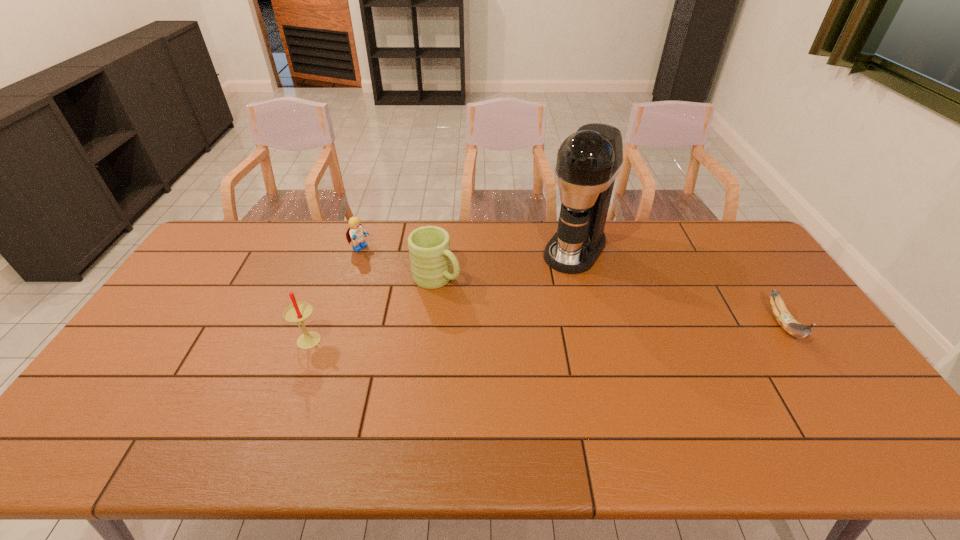
What are the coordinates of `Lego present at the far edge` in the screenshot? It's located at (356, 234).

You are a GUI agent. You are given a task and a screenshot of the screen. Output one action in this format:
    pyautogui.click(x=<x>, y=<y>)
    Task: Click on the object at the right edge
    
    Given the screenshot: What is the action you would take?
    pyautogui.click(x=785, y=319)

Image resolution: width=960 pixels, height=540 pixels. I want to click on vacant region at the far edge of the desktop, so click(x=483, y=221).

In the image, there is a desktop. Identify the location of vacant space at the near edge. (781, 409).

The height and width of the screenshot is (540, 960). In the image, there is a desktop. In order to click on vacant space at the left edge in this screenshot , I will do `click(144, 339)`.

What are the coordinates of `free location at the near left corner` in the screenshot? It's located at (125, 410).

Where is `blank space at the far right corner of the desktop`? This screenshot has width=960, height=540. blank space at the far right corner of the desktop is located at coordinates (758, 255).

Image resolution: width=960 pixels, height=540 pixels. I want to click on vacant space that's between the banana and the second tallest object, so click(545, 332).

You are a GUI agent. You are given a task and a screenshot of the screen. Output one action in this format:
    pyautogui.click(x=<x>, y=<y>)
    Task: Click on the vacant space in between the candle and the third object from right to left
    The width and height of the screenshot is (960, 540).
    Given the screenshot: What is the action you would take?
    pyautogui.click(x=372, y=309)

Where is `free space between the candle and the second shortest object`? The width and height of the screenshot is (960, 540). free space between the candle and the second shortest object is located at coordinates (334, 295).